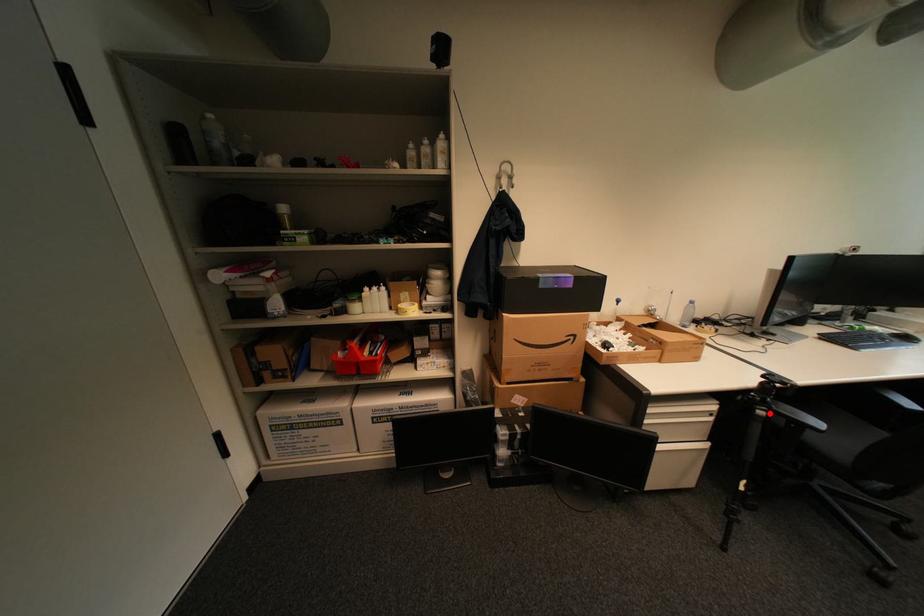
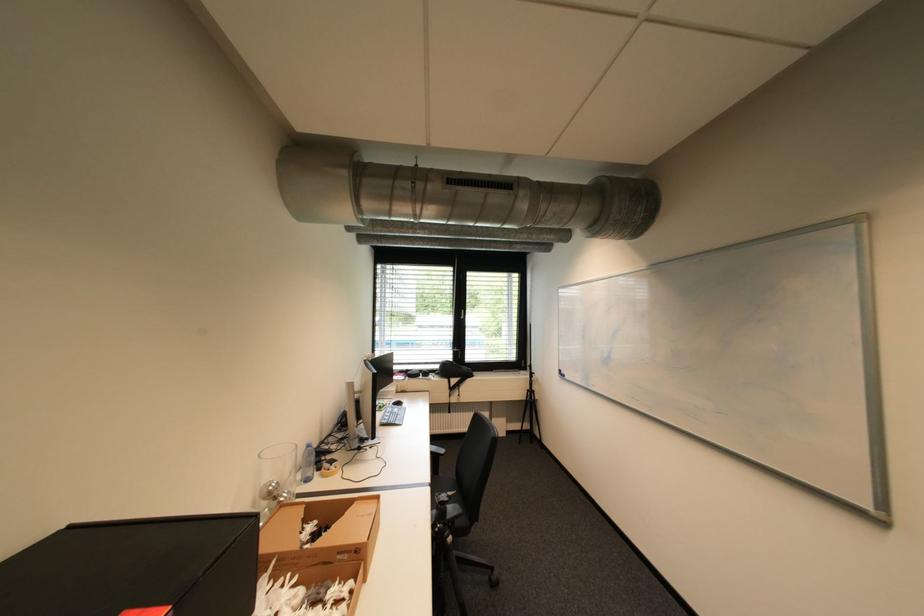
Locate, in the second image, the point that corresponds to the highlighted location in the first image.

(458, 540)